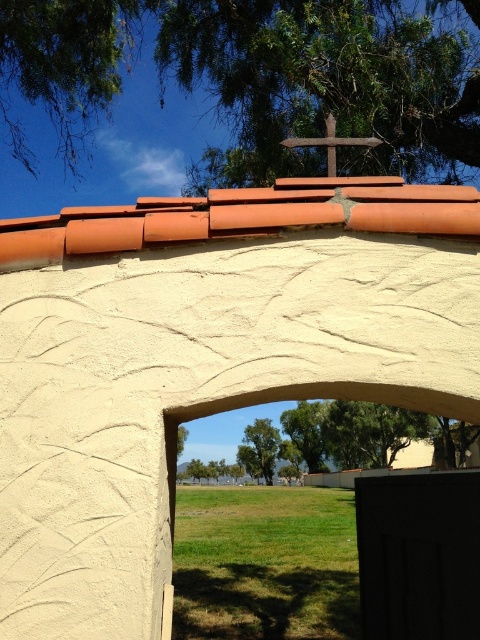
Question: Which point is farther to the camera?

Choices:
 (A) (137, 230)
 (B) (309, 141)
 (C) (261, 465)

Answer: (C)

Question: Which point is farther to the camera?

Choices:
 (A) wooden cross at upper center
 (B) terracotta tiles at upper center
 (C) smooth stucco arch at upper center

Answer: (A)

Question: Is terracotta tiles at upper center wider than green leafy tree at center?

Choices:
 (A) no
 (B) yes

Answer: (A)

Question: Which of the following is the farthest from the observer?

Choices:
 (A) green leafy tree at upper center
 (B) smooth stucco arch at upper center
 (C) wooden cross at upper center

Answer: (A)

Question: Where is green leafy tree at upper center located in relation to wooden cross at upper center in the image?

Choices:
 (A) above
 (B) below

Answer: (A)

Question: In this image, where is terracotta tiles at upper center located relative to green leafy tree at center?

Choices:
 (A) below
 (B) above

Answer: (B)